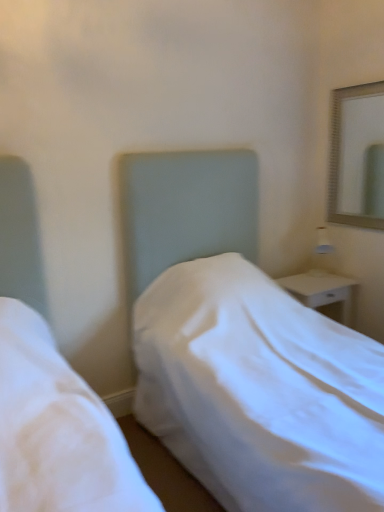
Find the location of `free space above silver metallic mirror at upper right (from a real-world perspective)`. free space above silver metallic mirror at upper right (from a real-world perspective) is located at coordinates (358, 80).